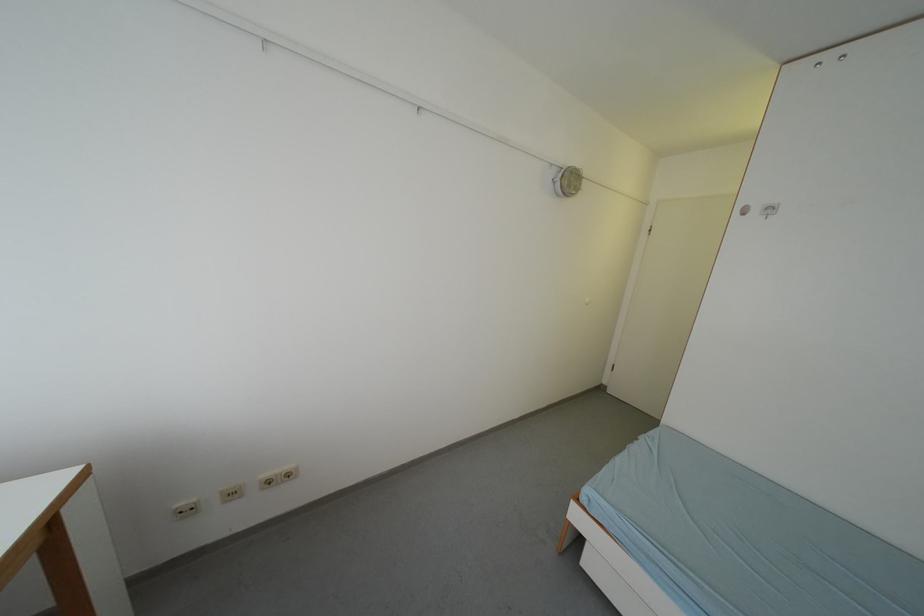
Find where to push the white wall outlet. Please return your answer as a coordinate pair (x, y).

(232, 493)